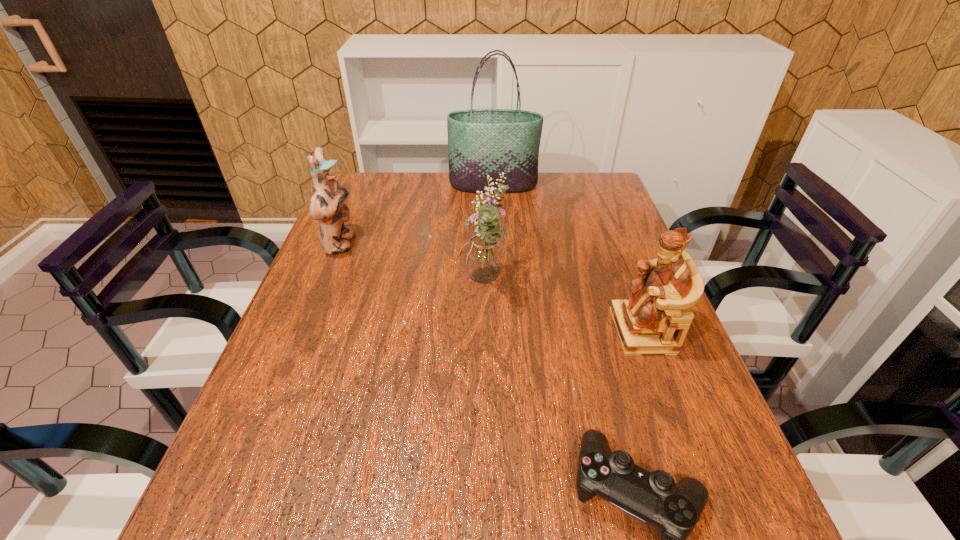
Identify the location of the tallest object. The width and height of the screenshot is (960, 540). (481, 142).

I want to click on tote bag, so click(x=481, y=142).

Where is `bouquet`? This screenshot has width=960, height=540. bouquet is located at coordinates (483, 257).

You are a GUI agent. You are given a task and a screenshot of the screen. Output one action in this format:
    pyautogui.click(x=<x>, y=<y>)
    Task: Click on the farther figurine
    
    Given the screenshot: What is the action you would take?
    pyautogui.click(x=327, y=205)

Find the location of a particular element. the left figurine is located at coordinates (327, 205).

This screenshot has height=540, width=960. I want to click on the nearer figurine, so pyautogui.click(x=655, y=319).

Identify the location of vacant region located on the front of the farthest object. (494, 218).

You are a GUI agent. You are given a task and a screenshot of the screen. Output one action in this format:
    pyautogui.click(x=<x>, y=<y>)
    Task: Click on the free point located 0.250m on the front-facing side of the bouquet
    The height and width of the screenshot is (540, 960).
    Given the screenshot: What is the action you would take?
    pyautogui.click(x=361, y=285)

Locate an element on the screen. The height and width of the screenshot is (540, 960). vacant region located 0.170m on the front-facing side of the bouquet is located at coordinates (393, 285).

At what (x,y) coordinates should I click in order to perform the action: click on free space located 0.300m on the front-facing side of the bouquet. Please return your answer as a coordinate pair (x, y). The width and height of the screenshot is (960, 540). Looking at the image, I should click on (341, 285).